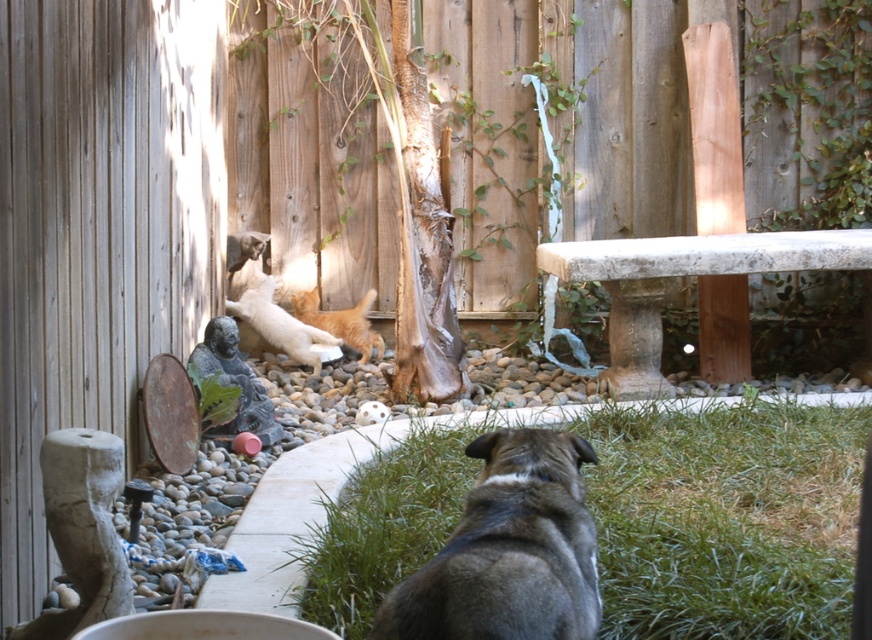
Question: Is green grass at lower center smaller than fluffy white cat at center?

Choices:
 (A) no
 (B) yes

Answer: (A)

Question: Which object appears farthest from the camera in this image?

Choices:
 (A) green grass at lower center
 (B) fluffy orange cat at center
 (C) brown fur dog at lower center

Answer: (B)

Question: Does brown fur dog at lower center have a lesser width compared to fluffy orange cat at center?

Choices:
 (A) yes
 (B) no

Answer: (A)

Question: Considering the relative positions of fluffy white cat at center and fluffy orange cat at center in the image provided, where is fluffy white cat at center located with respect to fluffy orange cat at center?

Choices:
 (A) below
 (B) above

Answer: (A)

Question: Which object is positioned farthest from the green grass at lower center?

Choices:
 (A) fluffy orange cat at center
 (B) brown fur dog at lower center
 (C) fluffy white cat at center

Answer: (A)

Question: Which point is closer to the camera?

Choices:
 (A) fluffy white cat at center
 (B) fluffy orange cat at center
 (C) green grass at lower center
 (D) brown fur dog at lower center

Answer: (D)